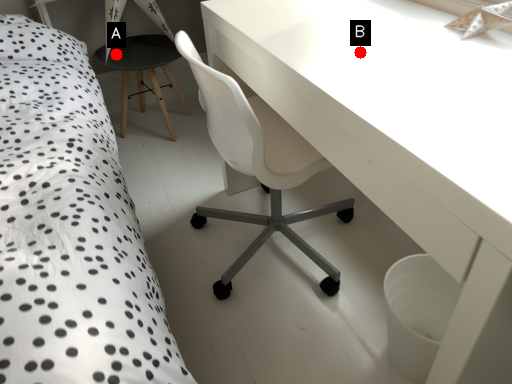
Question: Two points are circled on the image, labeled by A and B beside each circle. Which point is closer to the camera taking this photo?

Choices:
 (A) A is closer
 (B) B is closer

Answer: (B)